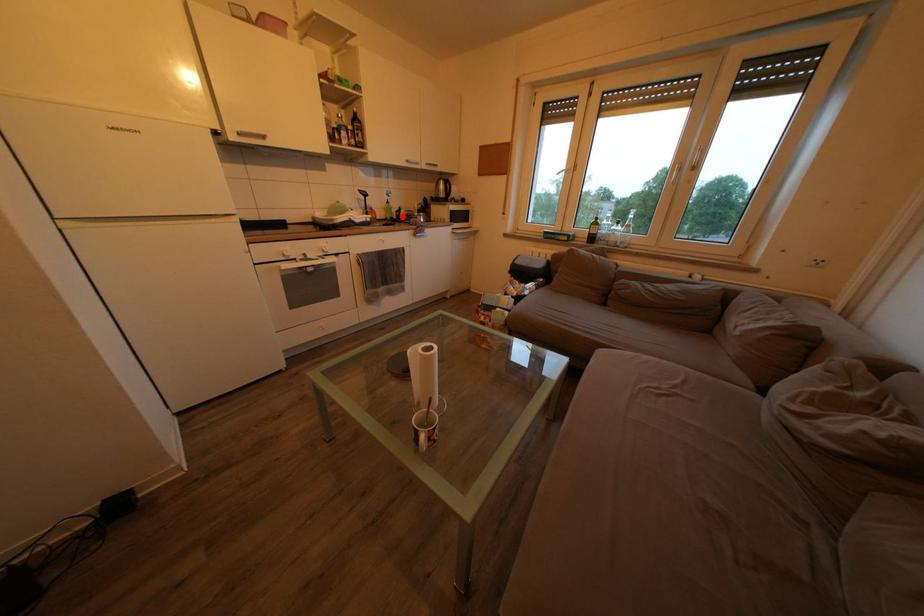
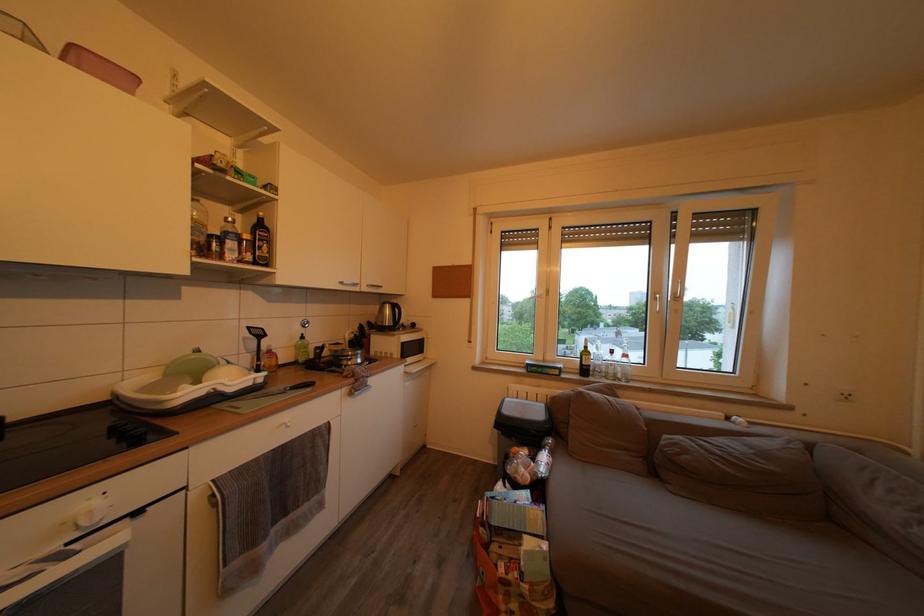
Question: I am providing you with two images of the same scene from different viewpoints. A red point is shown in image1. For the corresponding object point in image2, is it positioned nearer or farther from the camera?

Choices:
 (A) Nearer
 (B) Farther

Answer: (B)